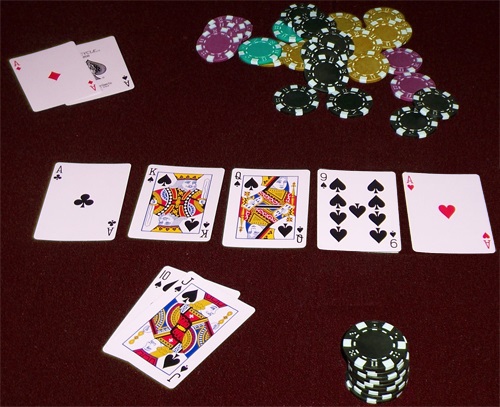
You are a GUI agent. You are given a task and a screenshot of the screen. Output one action in this format:
    pyautogui.click(x=<x>, y=<y>)
    Task: Click on the poker table
    This screenshot has height=407, width=500.
    Given the screenshot: What is the action you would take?
    pos(293,357)